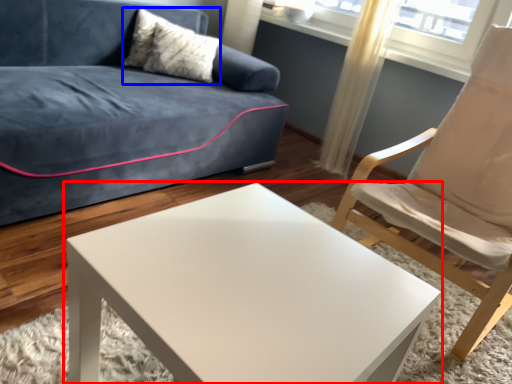
Question: Among these objects, which one is nearest to the camera, coffee table (highlighted by a red box) or pillow (highlighted by a blue box)?

Choices:
 (A) coffee table
 (B) pillow

Answer: (A)